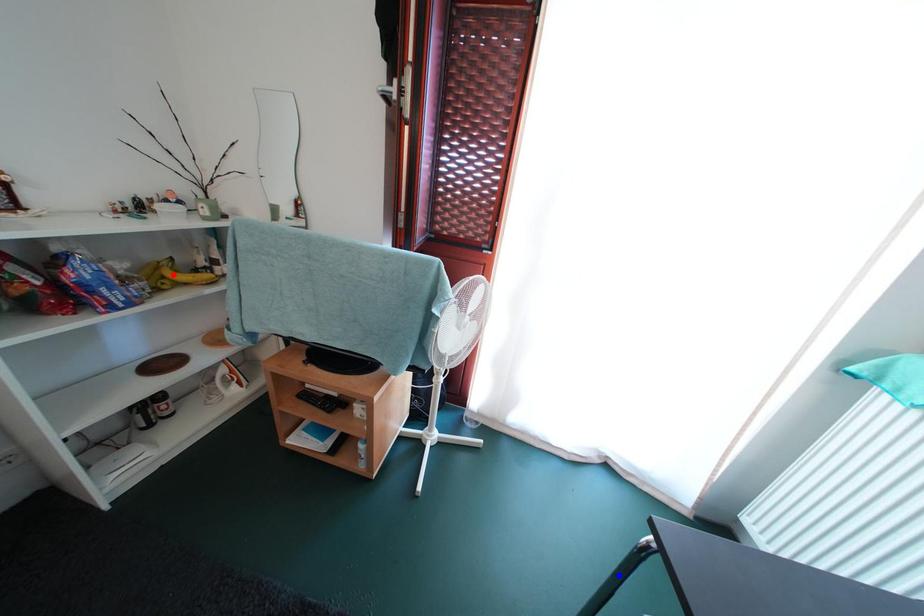
Question: Which of the two points in the image is closer to the camera?

Choices:
 (A) Blue point is closer.
 (B) Red point is closer.

Answer: (A)